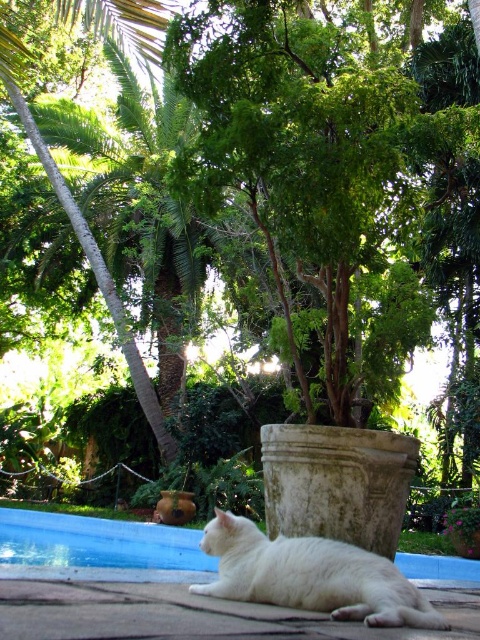
Question: Is white fur cat at lower left in front of blue smooth swimming pool at lower center?

Choices:
 (A) yes
 (B) no

Answer: (A)

Question: Which object is farther from the camera taking this photo?

Choices:
 (A) blue smooth swimming pool at lower center
 (B) white fur cat at lower left

Answer: (A)

Question: Is white fur cat at lower left below blue smooth swimming pool at lower center?

Choices:
 (A) yes
 (B) no

Answer: (B)

Question: Among these objects, which one is nearest to the camera?

Choices:
 (A) white fur cat at lower left
 (B) blue smooth swimming pool at lower center

Answer: (A)

Question: Is white fur cat at lower left further to camera compared to blue smooth swimming pool at lower center?

Choices:
 (A) no
 (B) yes

Answer: (A)